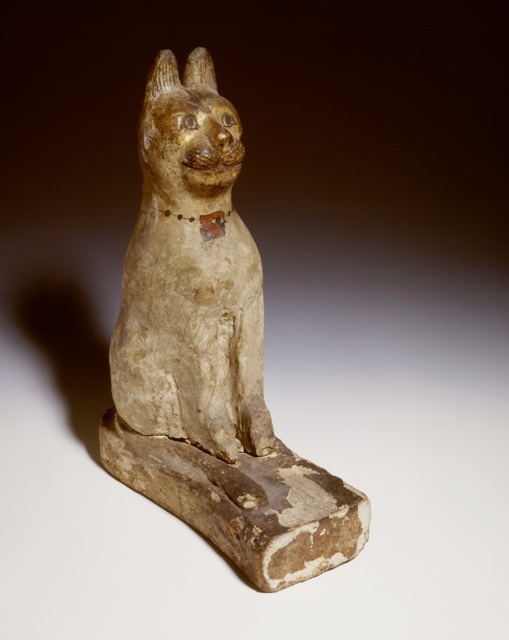
You are an archaeologist examining a 3D model of an ancient Egyptian statuette. The model has a coordinate system where the bottom left corner is the origin point. The archaeologist wants to place a small golden plaque at the exact center of the base. The matte beige cat statue at center is currently located at point 0.555, 0.413. What are the coordinates of the center of the base?

The center of the base would be at coordinates (254,320), as the base is rectangular and centered in the image. The matte beige cat statue at center is slightly offset from the center point, so the plaque should be placed at (254,320).

You are an archaeologist examining the ancient Egyptian statuette. You notice two objects labeled as matte beige cat statue at center and matte beige cat at center. Which one is taller?

The matte beige cat statue at center is taller than the matte beige cat at center.